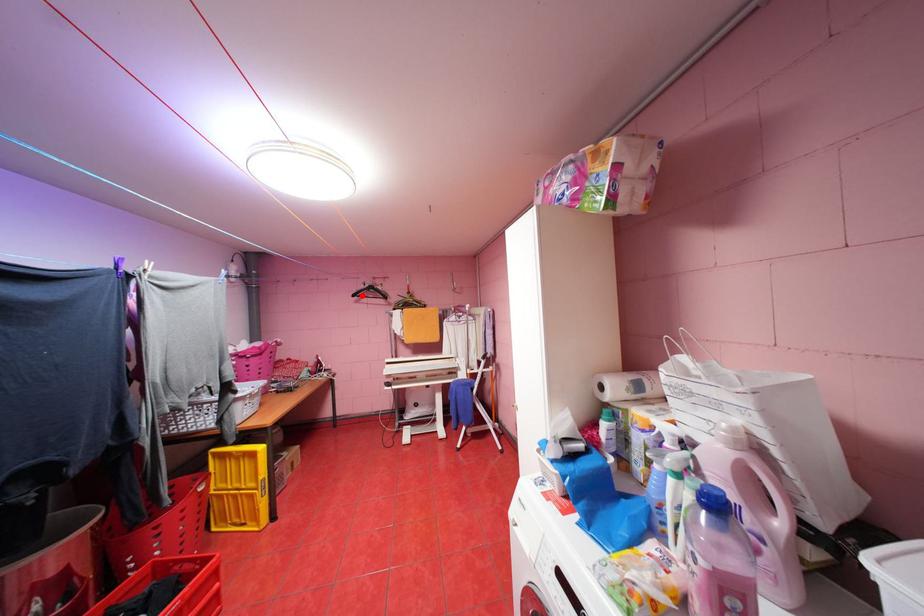
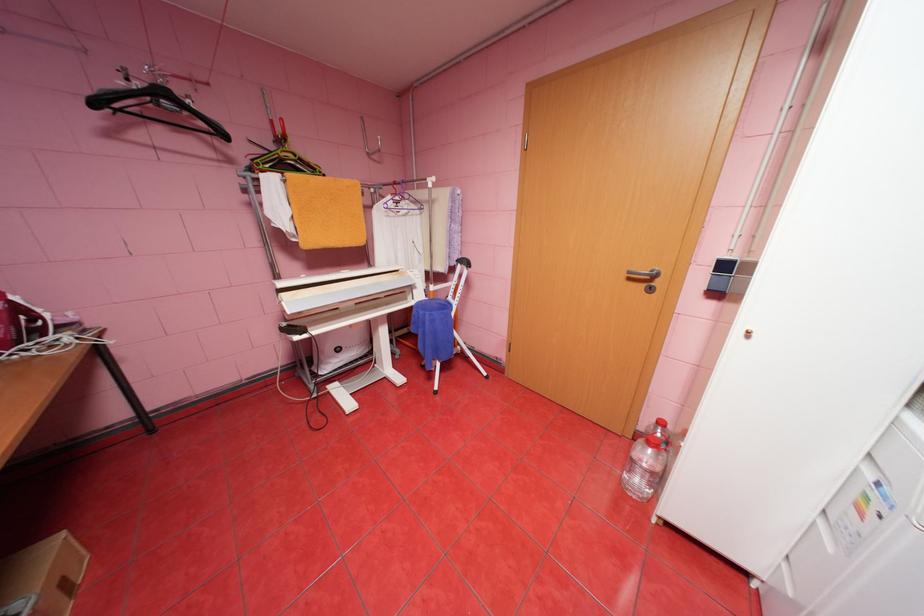
Question: I am providing you with two images of the same scene from different viewpoints. In image1, a red point is highlighted. Considering the same 3D point in image2, which of the following is correct?

Choices:
 (A) It is closer
 (B) It is farther

Answer: (B)